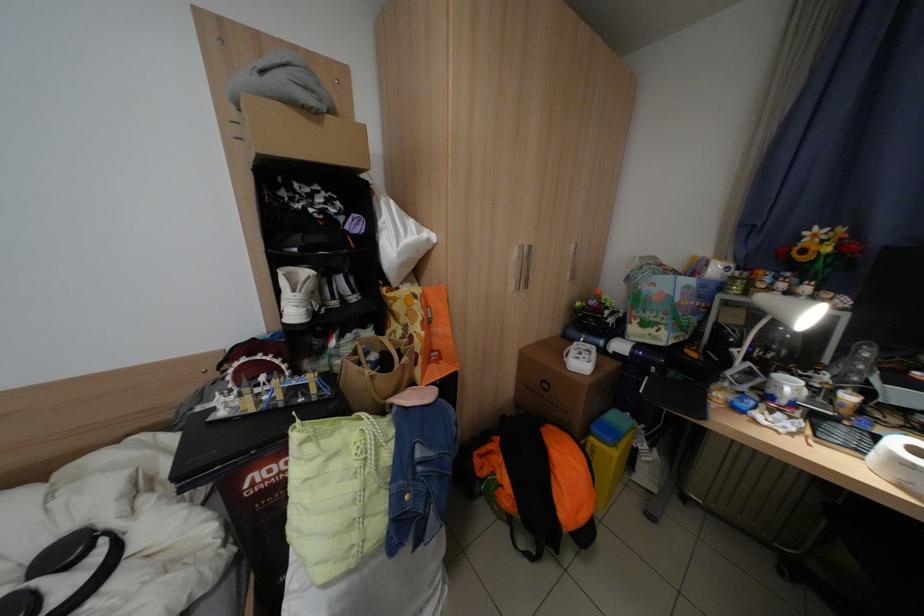
This screenshot has width=924, height=616. I want to click on yellow box, so click(609, 452).